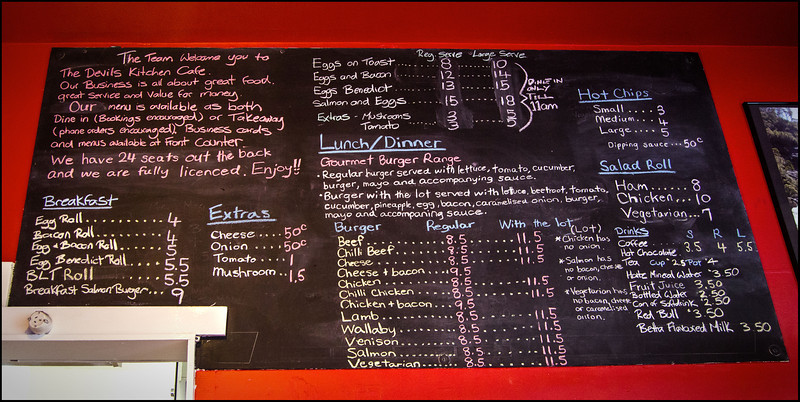
You are a GUI agent. You are given a task and a screenshot of the screen. Output one action in this format:
    pyautogui.click(x=<x>, y=<y>)
    Task: Click on the edge of picture frame
    This screenshot has height=402, width=800.
    Given the screenshot: What is the action you would take?
    pyautogui.click(x=765, y=154)